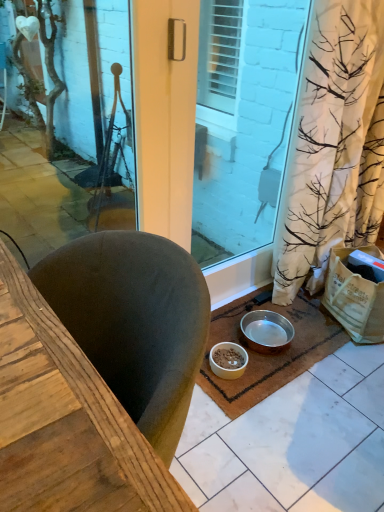
In order to click on vacant area that lies to the right of transparent glass screen door at center in this screenshot , I will do `click(276, 314)`.